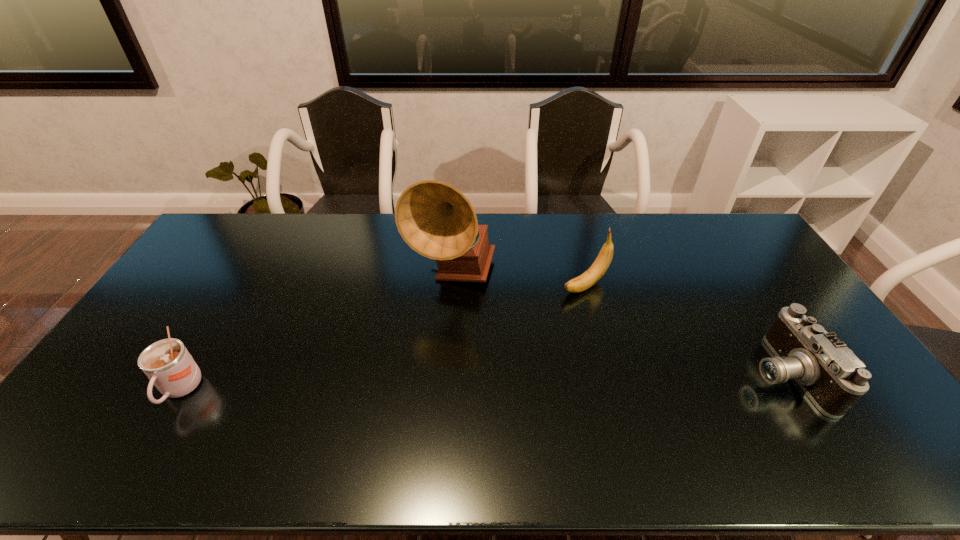
The height and width of the screenshot is (540, 960). In order to click on free space at the far edge of the desktop in this screenshot , I will do pos(587,233).

The image size is (960, 540). In the image, there is a desktop. Identify the location of free space at the near edge. (800, 408).

Where is `vacant region at the left edge of the desktop`? vacant region at the left edge of the desktop is located at coordinates (193, 275).

You are a GUI agent. You are given a task and a screenshot of the screen. Output one action in this format:
    pyautogui.click(x=<x>, y=<y>)
    Task: Click on the free space at the right edge
    The width and height of the screenshot is (960, 540).
    Given the screenshot: What is the action you would take?
    pyautogui.click(x=732, y=267)

The width and height of the screenshot is (960, 540). Find the location of `blank space at the near right corner`. blank space at the near right corner is located at coordinates (860, 400).

You are a GUI agent. You are given a task and a screenshot of the screen. Output one action in this format:
    pyautogui.click(x=<x>, y=<y>)
    Task: Click on the empty space between the third shortest object and the cup
    
    Given the screenshot: What is the action you would take?
    pyautogui.click(x=383, y=338)

At what (x,y) coordinates should I click in order to perform the action: click on free spot between the third shortest object and the tallest object. Please return your answer as a coordinate pair (x, y). Looking at the image, I should click on (518, 280).

This screenshot has width=960, height=540. I want to click on empty space between the phonograph record and the camera, so click(x=618, y=324).

This screenshot has width=960, height=540. In order to click on vacant area between the third object from left to right and the phonograph record in this screenshot , I will do `click(518, 280)`.

This screenshot has width=960, height=540. Identify the location of vacant area between the third shortest object and the rightmost object. (684, 329).